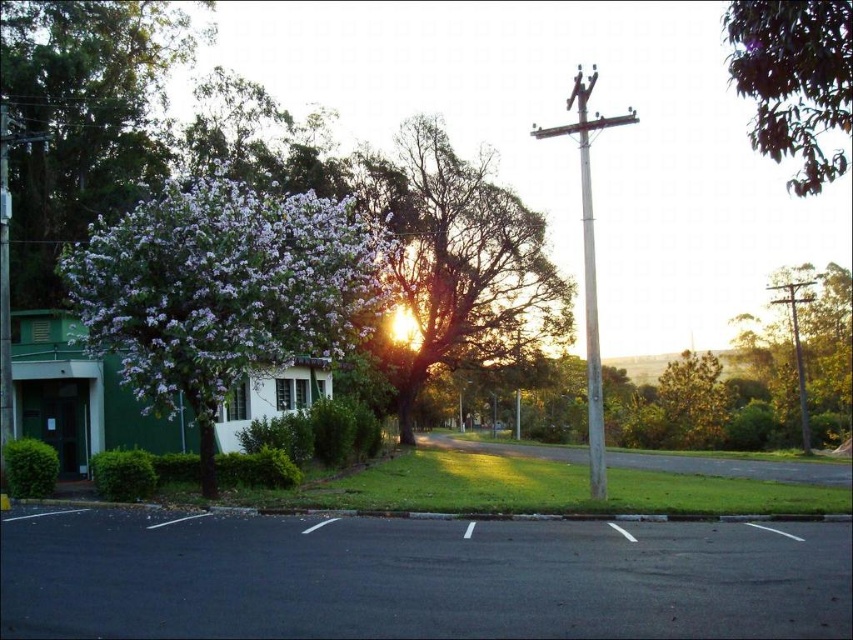
Question: Is green leafy tree at upper right thinner than silver metallic telegraph pole at center right?

Choices:
 (A) no
 (B) yes

Answer: (A)

Question: Which point appears farthest from the camera in this image?

Choices:
 (A) pos(440,241)
 (B) pos(805,138)
 (C) pos(84,273)
 (D) pos(535,132)

Answer: (A)

Question: Which is farther from the purple leafy tree at center?

Choices:
 (A) green textured pole at right
 (B) purple matte tree at left

Answer: (A)

Question: Which of the following is the closest to the observer?

Choices:
 (A) (799, 307)
 (B) (231, 360)

Answer: (B)

Question: Is green leafy tree at upper right closer to the viewer compared to green textured pole at right?

Choices:
 (A) no
 (B) yes

Answer: (B)

Question: Is green textured pole at right above silver metallic telegraph pole at center right?

Choices:
 (A) yes
 (B) no

Answer: (B)